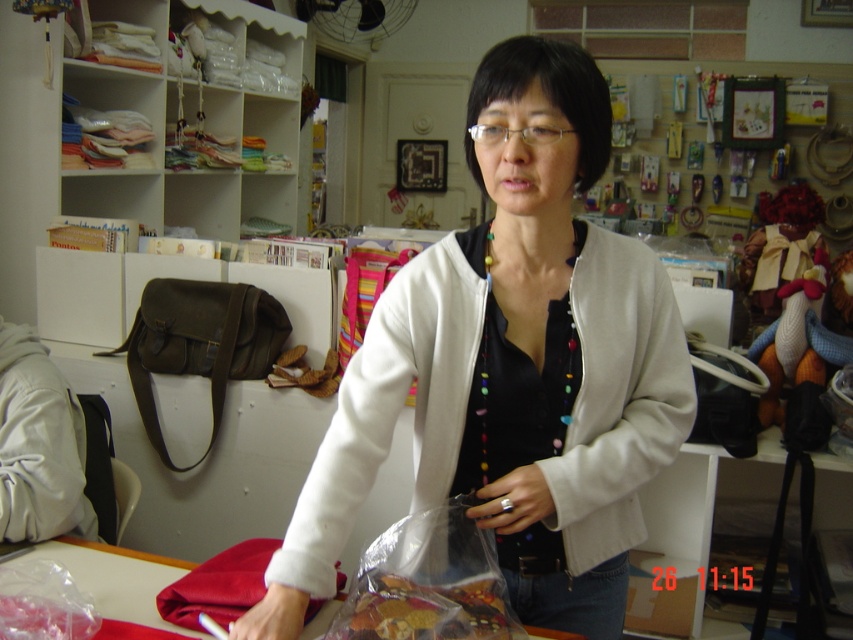
Which is more to the left, translucent plastic bag of dried fruits at center or smooth red fabric at center?

smooth red fabric at center is more to the left.

Where is `translucent plastic bag of dried fruits at center`? This screenshot has width=853, height=640. translucent plastic bag of dried fruits at center is located at coordinates (425, 609).

Between white matte jacket at center and translucent plastic bag at center, which one has less height?

With less height is translucent plastic bag at center.

This screenshot has height=640, width=853. Find the location of `white matte jacket at center`. white matte jacket at center is located at coordinates (512, 368).

Who is more distant from viewer, [582,380] or [149,413]?

Point [149,413]

Between white matte jacket at center and olive green leather bag at left, which one has more height?

With more height is white matte jacket at center.

Where is `white matte jacket at center`? The image size is (853, 640). white matte jacket at center is located at coordinates (512, 368).